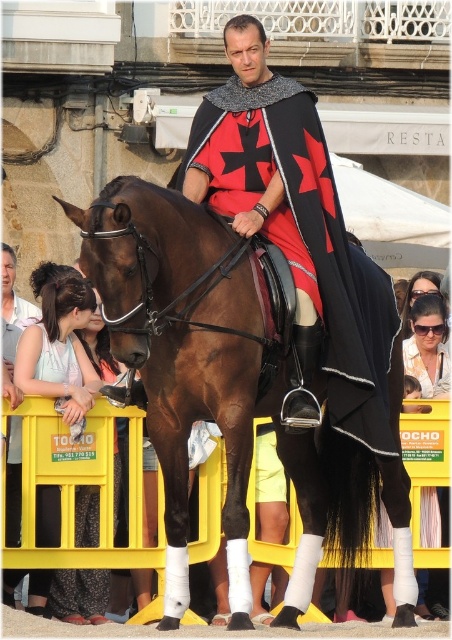
You are a photographer standing at the position of the viewer. You want to take a photo of the brown glossy horse at center. The camera you are using has a maximum focus range of 35 meters. Will you be able to focus on the horse?

The brown glossy horse at center is 37.79 meters away from the viewer. Since the camera can only focus up to 35 meters, it cannot focus on the horse at this distance.

What are the coordinates of the brown glossy horse at center?

The brown glossy horse at center is located at coordinates point [227,388].